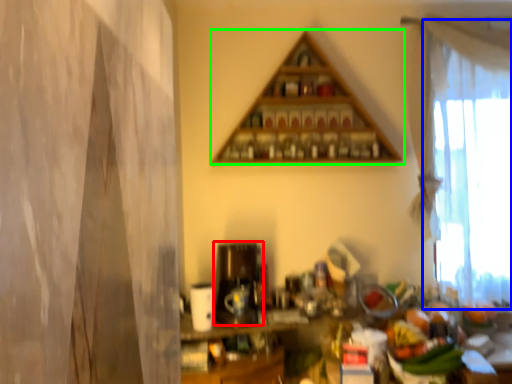
Question: Which is nearer to the appliance (highlighted by a red box)? curtain (highlighted by a blue box) or shelf (highlighted by a green box).

Choices:
 (A) curtain
 (B) shelf

Answer: (B)